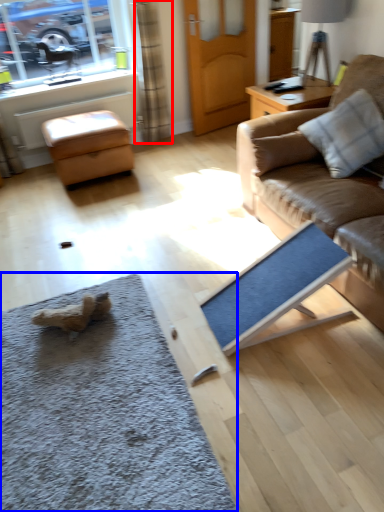
Question: Which object is closer to the camera taking this photo, curtain (highlighted by a red box) or doormat (highlighted by a blue box)?

Choices:
 (A) curtain
 (B) doormat

Answer: (B)